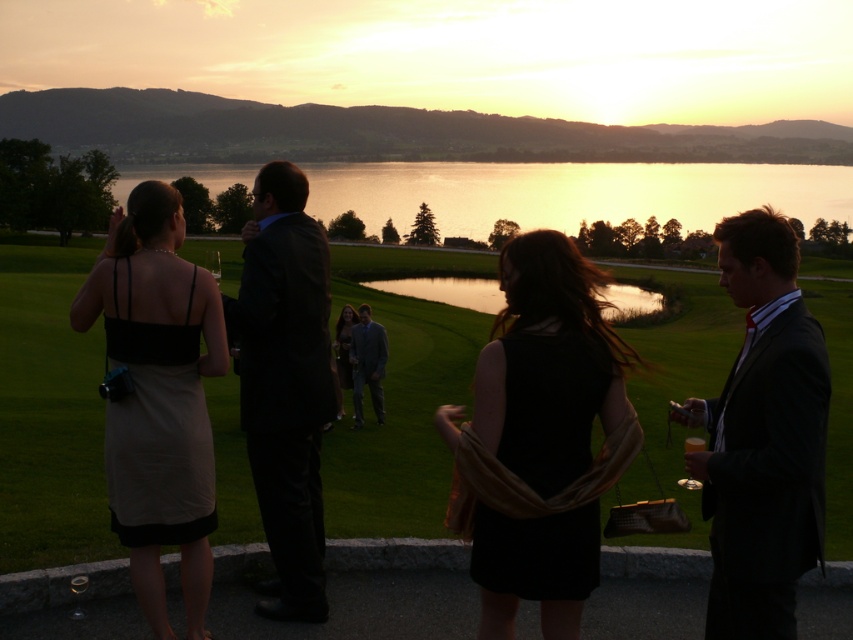
Question: Is reflective glass water at center smaller than shiny black suit at center?

Choices:
 (A) no
 (B) yes

Answer: (A)

Question: From the image, what is the correct spatial relationship of reflective glass water at center in relation to shiny black suit at center?

Choices:
 (A) right
 (B) left

Answer: (A)

Question: In this image, where is matte black dress at left located relative to matte gray suit at center?

Choices:
 (A) above
 (B) below

Answer: (A)

Question: Which object is the farthest from the matte black suit at right?

Choices:
 (A) reflective glass water at center
 (B) matte gray suit at center
 (C) matte black dress at left
 (D) green grass golf course at center

Answer: (A)

Question: Which object is closer to the camera taking this photo?

Choices:
 (A) green grass golf course at center
 (B) matte gray suit at center
 (C) matte black suit at right

Answer: (C)

Question: Estimate the real-world distances between objects in this image. Which object is farther from the matte gray suit at center?

Choices:
 (A) matte black suit at right
 (B) matte black dress at left
 (C) shiny black suit at center
 (D) reflective glass water at center

Answer: (D)